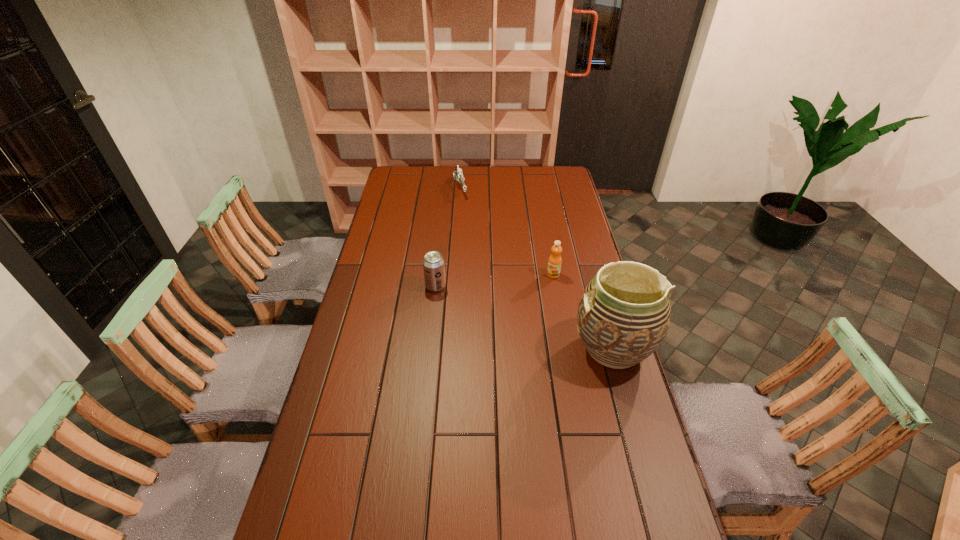
Image resolution: width=960 pixels, height=540 pixels. What are the coordinates of `object that is the third closest one to the third farthest object` in the screenshot? It's located at (457, 175).

Where is `object identified as the second closest to the nearest object`? Image resolution: width=960 pixels, height=540 pixels. object identified as the second closest to the nearest object is located at coordinates (433, 263).

At what (x,y) coordinates should I click in order to perform the action: click on free spot that satisfies the following two spatial constraints: 1. on the front side of the orange juice; 2. on the left side of the nearest object. Please return your answer as a coordinate pair (x, y). This screenshot has height=540, width=960. Looking at the image, I should click on (566, 348).

What are the coordinates of `free space that satisfies the following two spatial constraints: 1. on the back side of the orange juice; 2. on the left side of the second nearest object` in the screenshot? It's located at (437, 274).